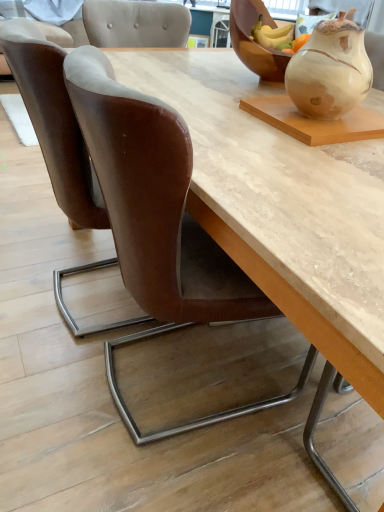
Question: Is brown leather chair at left, positioned as the 2th chair in left-to-right order, positioned before brown leather chair at lower left, placed as the 1th chair when sorted from left to right?

Choices:
 (A) no
 (B) yes

Answer: (B)

Question: Is brown leather chair at left, marked as the first chair in a right-to-left arrangement, outside of brown leather chair at lower left, placed as the 1th chair when sorted from left to right?

Choices:
 (A) yes
 (B) no

Answer: (A)

Question: Could you tell me if brown leather chair at left, marked as the first chair in a right-to-left arrangement, is facing brown leather chair at lower left, placed as the 1th chair when sorted from left to right?

Choices:
 (A) yes
 (B) no

Answer: (B)

Question: From a real-world perspective, is brown leather chair at left, positioned as the 2th chair in left-to-right order, on brown leather chair at lower left, marked as the second chair in a right-to-left arrangement?

Choices:
 (A) yes
 (B) no

Answer: (A)

Question: Considering the relative positions of brown leather chair at left, positioned as the 2th chair in left-to-right order, and brown leather chair at lower left, placed as the 1th chair when sorted from left to right, in the image provided, is brown leather chair at left, positioned as the 2th chair in left-to-right order, to the left of brown leather chair at lower left, placed as the 1th chair when sorted from left to right, from the viewer's perspective?

Choices:
 (A) yes
 (B) no

Answer: (B)

Question: Relative to brown leather chair at lower left, placed as the 1th chair when sorted from left to right, is matte ceramic vase at upper right in front or behind?

Choices:
 (A) behind
 (B) front

Answer: (B)

Question: Would you say matte ceramic vase at upper right is to the left or to the right of brown leather chair at lower left, placed as the 1th chair when sorted from left to right, in the picture?

Choices:
 (A) left
 (B) right

Answer: (B)

Question: From a real-world perspective, is matte ceramic vase at upper right positioned above or below brown leather chair at lower left, marked as the second chair in a right-to-left arrangement?

Choices:
 (A) below
 (B) above

Answer: (B)

Question: Is matte ceramic vase at upper right bigger or smaller than brown leather chair at lower left, marked as the second chair in a right-to-left arrangement?

Choices:
 (A) big
 (B) small

Answer: (B)

Question: Is matte ceramic vase at upper right wider or thinner than wooden bowl at upper right?

Choices:
 (A) wide
 (B) thin

Answer: (B)

Question: Is matte ceramic vase at upper right bigger or smaller than wooden bowl at upper right?

Choices:
 (A) big
 (B) small

Answer: (B)

Question: From the image's perspective, is matte ceramic vase at upper right positioned above or below wooden bowl at upper right?

Choices:
 (A) below
 (B) above

Answer: (A)

Question: Is matte ceramic vase at upper right inside or outside of wooden bowl at upper right?

Choices:
 (A) inside
 (B) outside

Answer: (B)

Question: Is wooden bowl at upper right in front of or behind matte ceramic vase at upper right in the image?

Choices:
 (A) front
 (B) behind

Answer: (B)

Question: In terms of height, does wooden bowl at upper right look taller or shorter compared to matte ceramic vase at upper right?

Choices:
 (A) tall
 (B) short

Answer: (A)